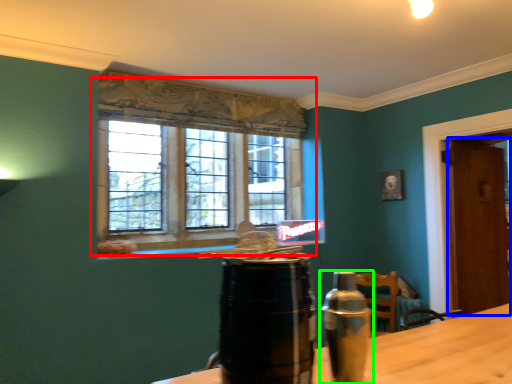
Question: Which object is positioned farthest from window (highlighted by a red box)? Select from door (highlighted by a blue box) and bottle (highlighted by a green box).

Choices:
 (A) door
 (B) bottle

Answer: (B)